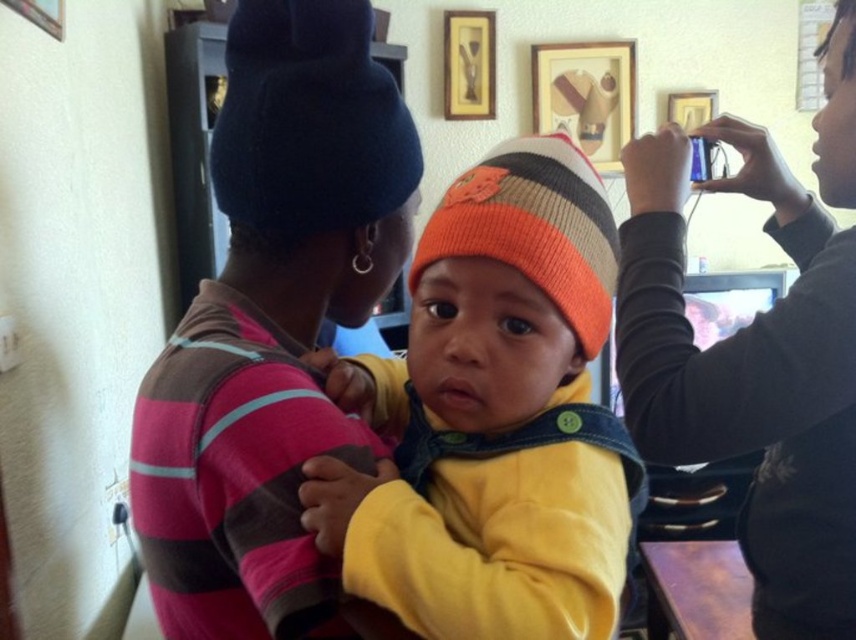
Question: Which of these objects is positioned farthest from the orange striped knit beanie at center?

Choices:
 (A) black woolen beanie at upper center
 (B) matte black beanie at upper center
 (C) black matte phone at upper right

Answer: (C)

Question: Considering the relative positions of matte black beanie at upper center and knitted orange beanie at center in the image provided, where is matte black beanie at upper center located with respect to knitted orange beanie at center?

Choices:
 (A) below
 (B) above

Answer: (B)

Question: Which point is farther to the camera?

Choices:
 (A) (269, 276)
 (B) (568, 241)
 (C) (497, 157)

Answer: (A)

Question: Is knitted orange beanie at center smaller than orange striped knit beanie at center?

Choices:
 (A) yes
 (B) no

Answer: (B)

Question: Which is nearer to the orange striped knit beanie at center?

Choices:
 (A) black woolen beanie at upper center
 (B) black matte phone at upper right

Answer: (A)

Question: Can you confirm if black matte phone at upper right is wider than orange striped knit beanie at center?

Choices:
 (A) no
 (B) yes

Answer: (B)